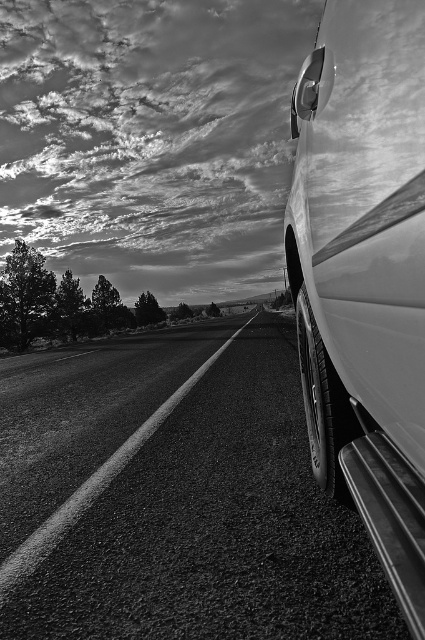
Does glossy white car at right appear under glossy white car door at lower right?

No.

Is glossy white car at right taller than glossy white car door at lower right?

Correct, glossy white car at right is much taller as glossy white car door at lower right.

Is point (305, 122) positioned before point (402, 211)?

No, it is behind (402, 211).

The width and height of the screenshot is (425, 640). I want to click on glossy white car at right, so click(x=365, y=273).

Between point (42, 396) and point (421, 305), which one is positioned in front?

Point (421, 305) is in front.

Measure the distance between asphalt road at center and camera.

The distance of asphalt road at center from camera is 2.13 meters.

The height and width of the screenshot is (640, 425). What are the coordinates of `asphalt road at center` in the screenshot? It's located at (175, 497).

Which is behind, point (22, 388) or point (396, 560)?

The point (22, 388) is behind.

Between asphalt road at center and glossy white car at right, which one is positioned lower?

asphalt road at center is lower down.

Describe the element at coordinates (175, 497) in the screenshot. This screenshot has width=425, height=640. I see `asphalt road at center` at that location.

This screenshot has width=425, height=640. Find the location of `asphalt road at center`. asphalt road at center is located at coordinates (175, 497).